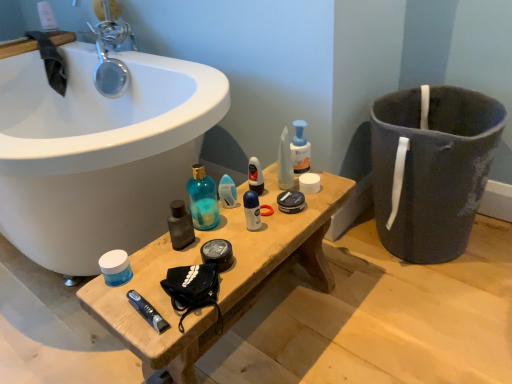
Find the location of `vacant area located to the right-hand side of shiny plastic mouthwash at center, which is the 2th mouthwash from right to left`. vacant area located to the right-hand side of shiny plastic mouthwash at center, which is the 2th mouthwash from right to left is located at coordinates (310, 188).